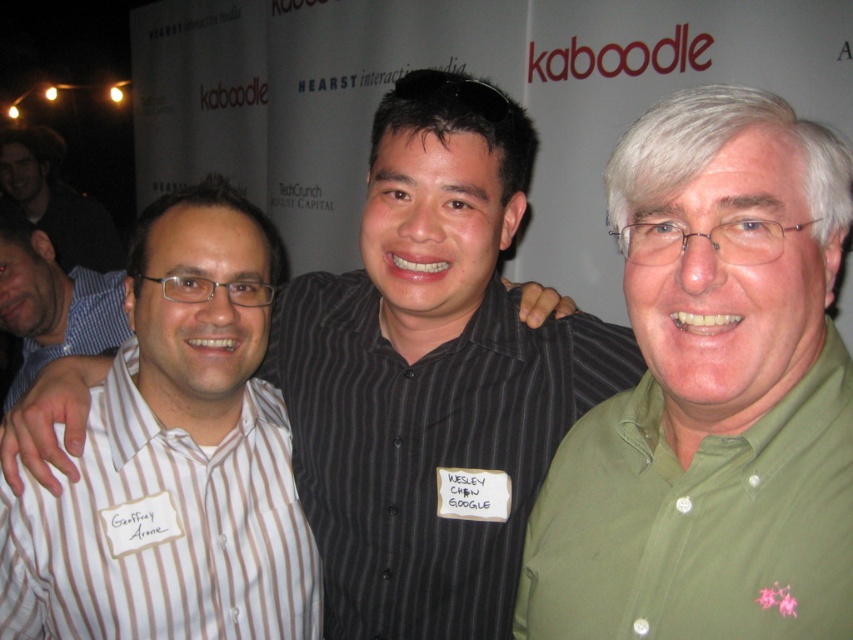
You are a photographer at the event and notice two people wearing the green cotton shirt at center and the blue striped shirt at left. Which one is standing to the right of the other?

The green cotton shirt at center is positioned on the right side of the blue striped shirt at left.

You are a photographer at the event. You need to adjust the lighting so that both the green cotton shirt at center and the blue striped shirt at left are equally visible. Given their sizes, which shirt might require more focused lighting adjustments?

The green cotton shirt at center is smaller than the blue striped shirt at left, so it might require more focused lighting adjustments to ensure it is as visible as the larger shirt.